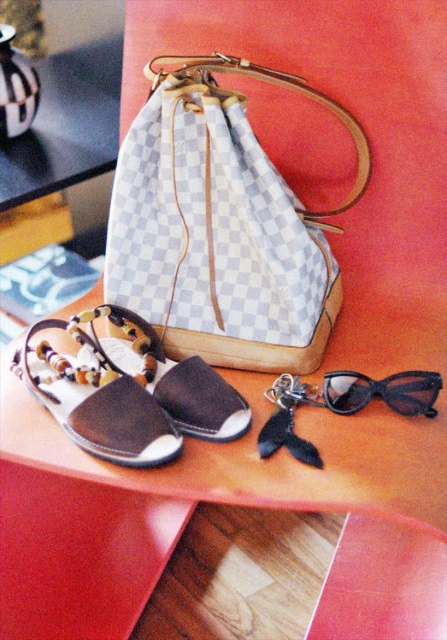
Does brown suede sandal at lower left appear on the left side of brown leather sandal at lower left?

Yes, brown suede sandal at lower left is to the left of brown leather sandal at lower left.

Describe the element at coordinates (96, 397) in the screenshot. The width and height of the screenshot is (447, 640). I see `brown suede sandal at lower left` at that location.

Where is `brown suede sandal at lower left`? Image resolution: width=447 pixels, height=640 pixels. brown suede sandal at lower left is located at coordinates (96, 397).

Measure the distance between white checkered fabric handbag at center and black plastic sunglasses at lower right.

They are 11.21 inches apart.

Who is lower down, white checkered fabric handbag at center or black plastic sunglasses at lower right?

Positioned lower is black plastic sunglasses at lower right.

What do you see at coordinates (222, 227) in the screenshot?
I see `white checkered fabric handbag at center` at bounding box center [222, 227].

Locate an element on the screen. The height and width of the screenshot is (640, 447). white checkered fabric handbag at center is located at coordinates (222, 227).

Between white checkered fabric handbag at center and brown leather sandal at lower left, which one is positioned lower?

brown leather sandal at lower left is below.

Is white checkered fabric handbag at center positioned before brown leather sandal at lower left?

Yes, it is.

Which is behind, point (291, 365) or point (202, 432)?

The point (291, 365) is behind.

Where is `white checkered fabric handbag at center`? Image resolution: width=447 pixels, height=640 pixels. white checkered fabric handbag at center is located at coordinates (222, 227).